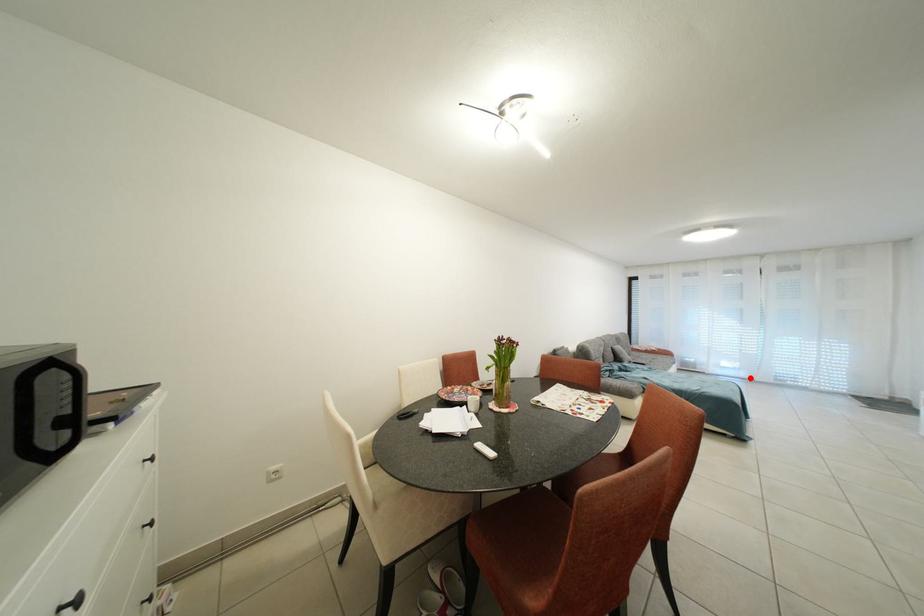
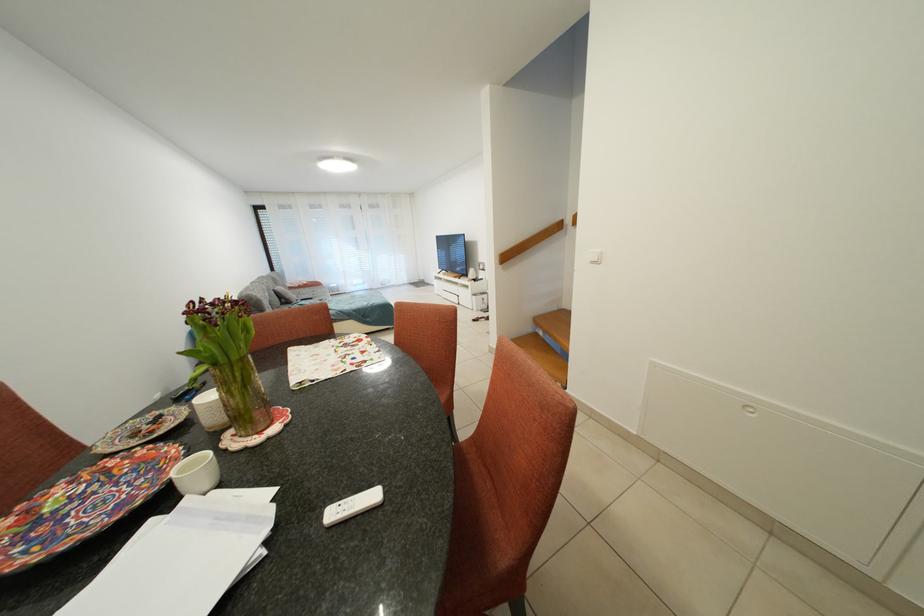
Question: I am providing you with two images of the same scene from different viewpoints. Image1 has a red point marked. In image2, the corresponding 3D location appears at what relative position? Reply with the corresponding letter.

Choices:
 (A) Closer
 (B) Farther

Answer: (A)